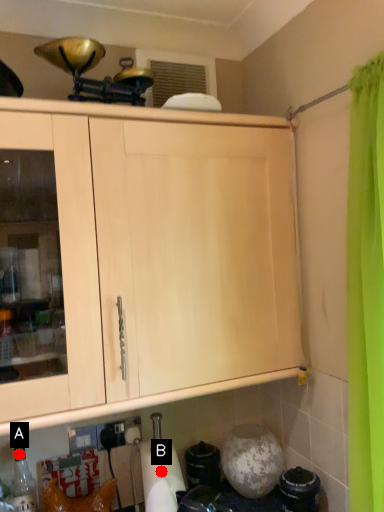
Question: Two points are circled on the image, labeled by A and B beside each circle. Among these points, which one is farthest from the camera?

Choices:
 (A) A is further
 (B) B is further

Answer: (A)